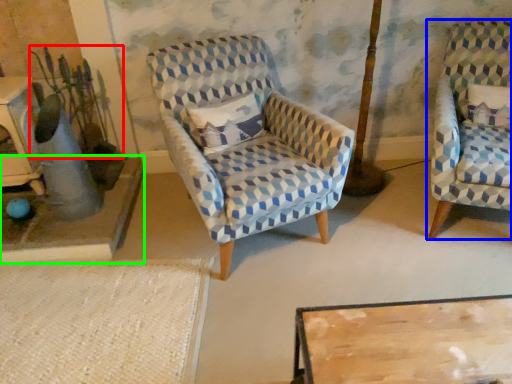
Question: Which is nearer to the plant (highlighted by a red box)? chair (highlighted by a blue box) or table (highlighted by a green box).

Choices:
 (A) chair
 (B) table

Answer: (B)